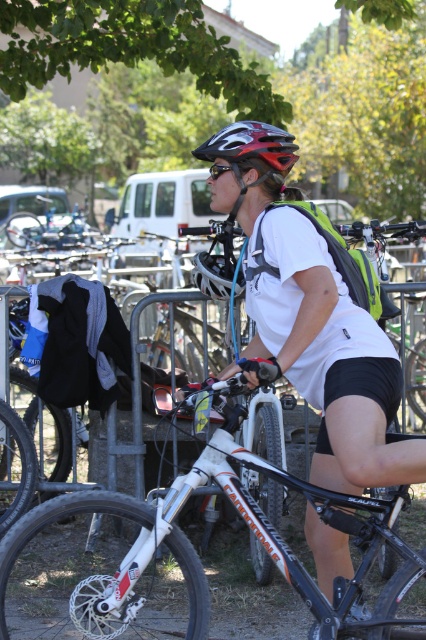
You are a photographer trying to capture a cyclist and their bike in the scene. You notice the white matte mountain bike at center and the black matte sunglasses at center. Which object should you focus on first if you want to photograph the one closer to the left side?

The black matte sunglasses at center should be focused on first since it is positioned to the left of the white matte mountain bike at center.

You are a participant in a cycling event and need to place your black matte sunglasses at center in your backpack. Before doing so, you want to ensure there is enough space. Given that the white matte mountain bike at center is taller than the sunglasses, can you determine if the sunglasses will fit vertically in your backpack?

The white matte mountain bike at center is taller than the black matte sunglasses at center, so the sunglasses will fit vertically in your backpack since they are shorter than the bike.

You are a photographer trying to capture the cyclist in the scene. Since the white matte shirt at center and the white matte mountain bike at center are both in focus, which object will appear bigger in your photo?

The white matte shirt at center will appear bigger in the photo because it is larger in size than the white matte mountain bike at center.